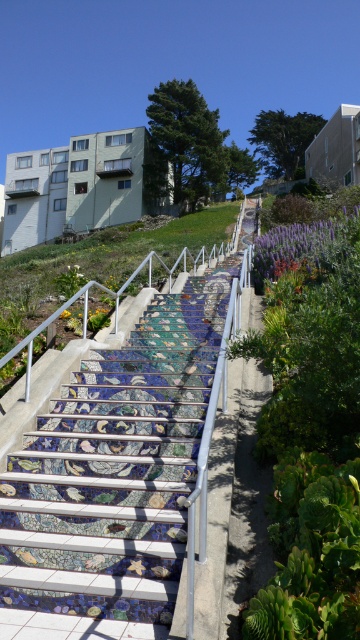
You are standing at the bottom of the staircase and want to place a small potted plant on the nearest available spot. The mosaic tile stairs at center and the yellow matte flower at lower center are in your view. Which object should you place the plant near to ensure it is closer to the ground level?

The mosaic tile stairs at center is located below the yellow matte flower at lower center, so placing the plant near the mosaic tile stairs at center would be closer to the ground level.

You are standing at the bottom of the staircase and want to reach the top. You notice two points marked on the mosaic tiles. Which point, point (317, 252) or point (64, 316), is closer to you as you look up the stairs?

Point (64, 316) is closer to you because it is positioned lower on the staircase, making it nearer to your current position at the bottom.

You are standing at the bottom of the staircase and want to place a small decorative item exactly at the point marked as point (291, 246). Which object in the scene is positioned at that exact coordinate?

The purple matte flower at upper center is located at point (291, 246).